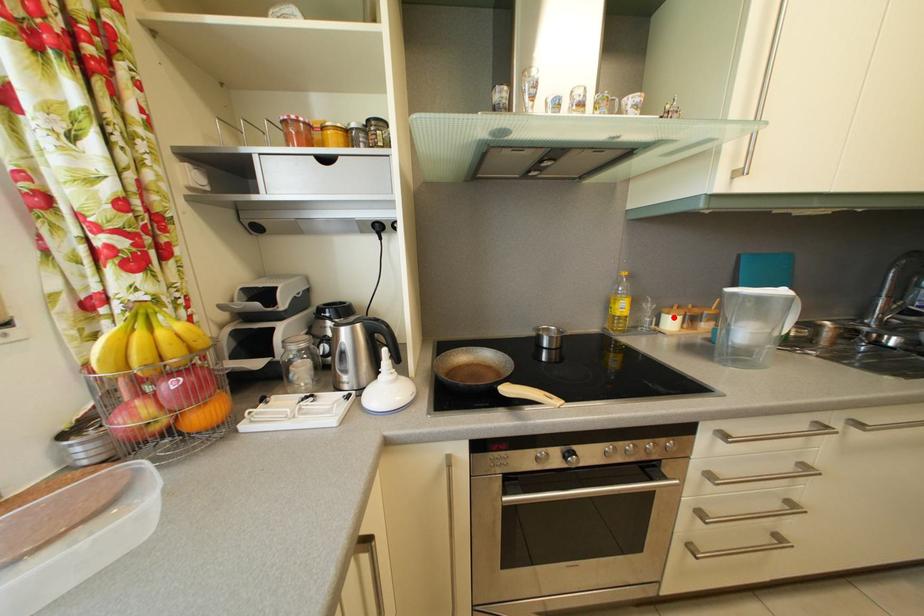
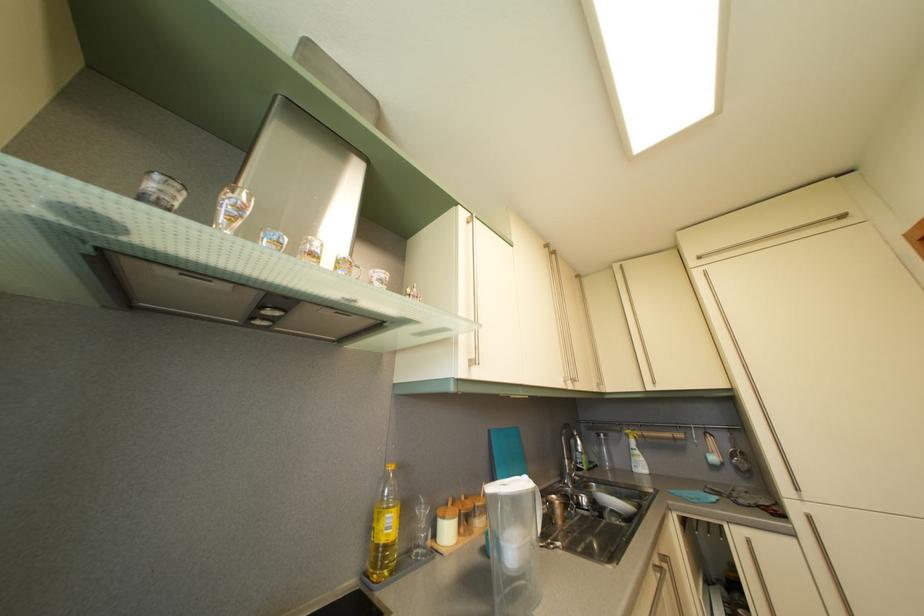
Locate, in the second image, the point that corresponds to the highlighted location in the first image.

(448, 519)